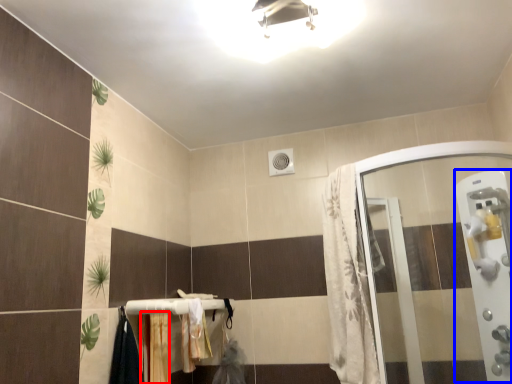
Question: Which point is further to the camera, curtain (highlighted by a red box) or screen door (highlighted by a blue box)?

Choices:
 (A) curtain
 (B) screen door

Answer: (A)